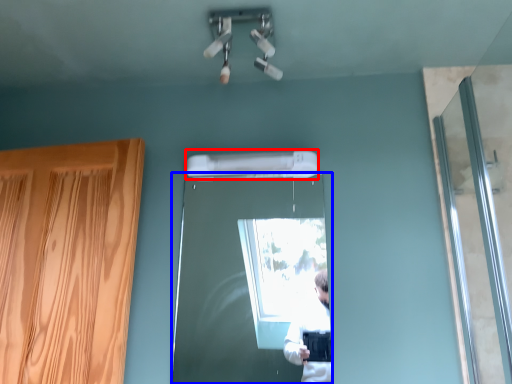
Question: Which point is further to the camera, air conditioner (highlighted by a red box) or door (highlighted by a blue box)?

Choices:
 (A) air conditioner
 (B) door

Answer: (A)